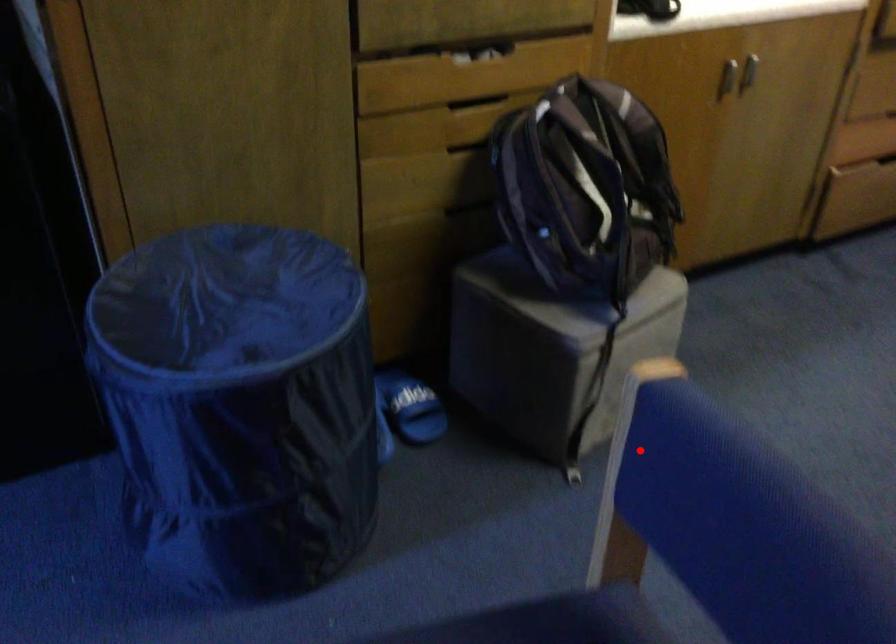
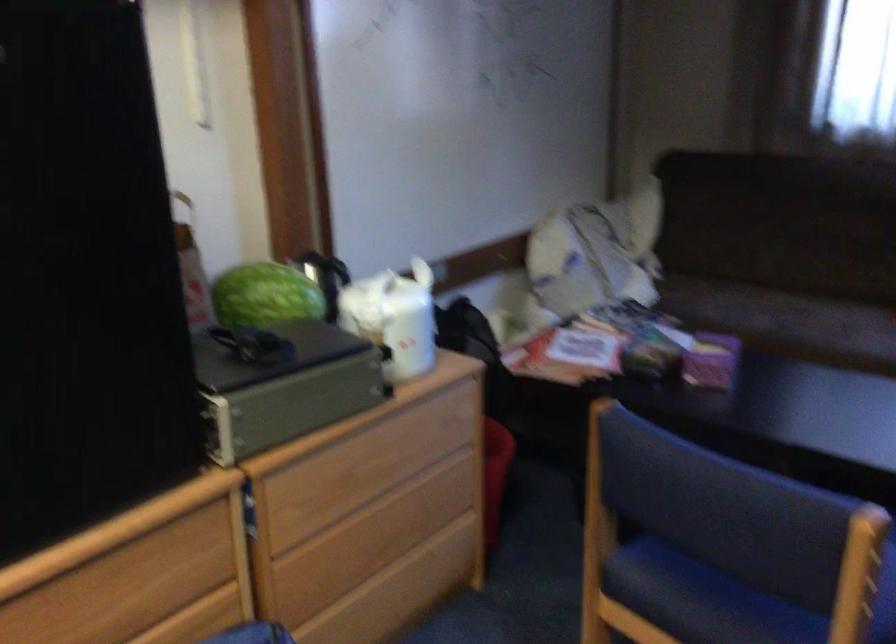
Question: I am providing you with two images of the same scene from different viewpoints. Image1 has a red point marked. In image2, the corresponding 3D location appears at what relative position? Reply with the corresponding letter.

Choices:
 (A) Closer
 (B) Farther

Answer: (B)